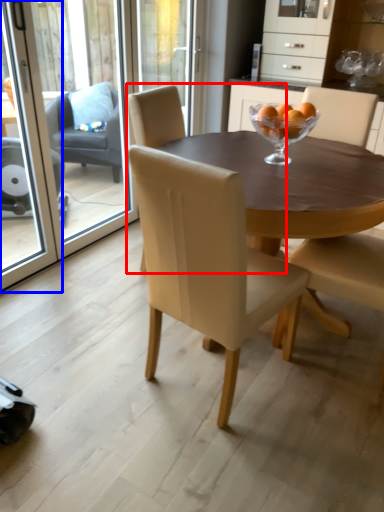
Question: Which object appears closest to the camera in this image, chair (highlighted by a red box) or screen door (highlighted by a blue box)?

Choices:
 (A) chair
 (B) screen door

Answer: (B)